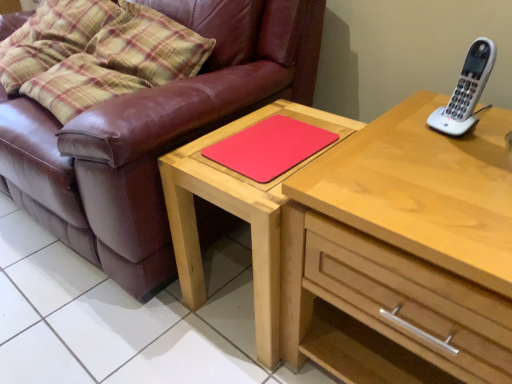
Where is `free location to the left of white plastic phone at upper right`? free location to the left of white plastic phone at upper right is located at coordinates (395, 137).